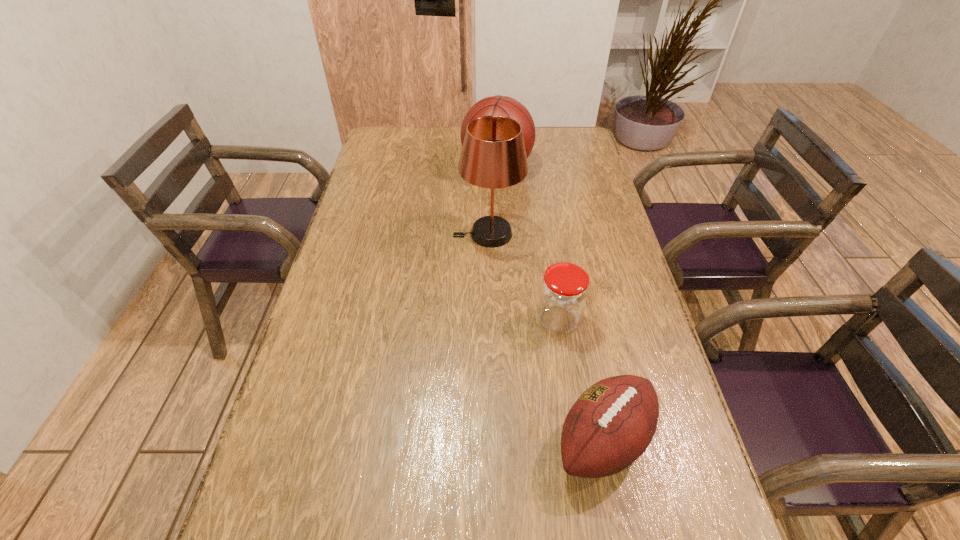
Locate an element on the screen. The width and height of the screenshot is (960, 540). vacant space situated 0.220m on the left of the jar is located at coordinates (452, 320).

Where is `free space located 0.170m on the left of the football (American)`? free space located 0.170m on the left of the football (American) is located at coordinates (472, 441).

Locate an element on the screen. Image resolution: width=960 pixels, height=540 pixels. object present at the far edge is located at coordinates (498, 105).

Where is `object present at the right edge`? The image size is (960, 540). object present at the right edge is located at coordinates (612, 423).

Identify the location of free region at the left edge of the desktop. The image size is (960, 540). (362, 252).

Where is `vacant space at the right edge of the desktop`? Image resolution: width=960 pixels, height=540 pixels. vacant space at the right edge of the desktop is located at coordinates (588, 260).

Identify the location of free spot at the far left corner of the desktop. (370, 152).

Where is `free spot between the third shortest object and the third farthest object`? The width and height of the screenshot is (960, 540). free spot between the third shortest object and the third farthest object is located at coordinates (528, 244).

Locate an element on the screen. Image resolution: width=960 pixels, height=540 pixels. vacant space that's between the jar and the tallest object is located at coordinates (523, 277).

Locate an element on the screen. object that ranks as the third closest to the football (American) is located at coordinates (498, 105).